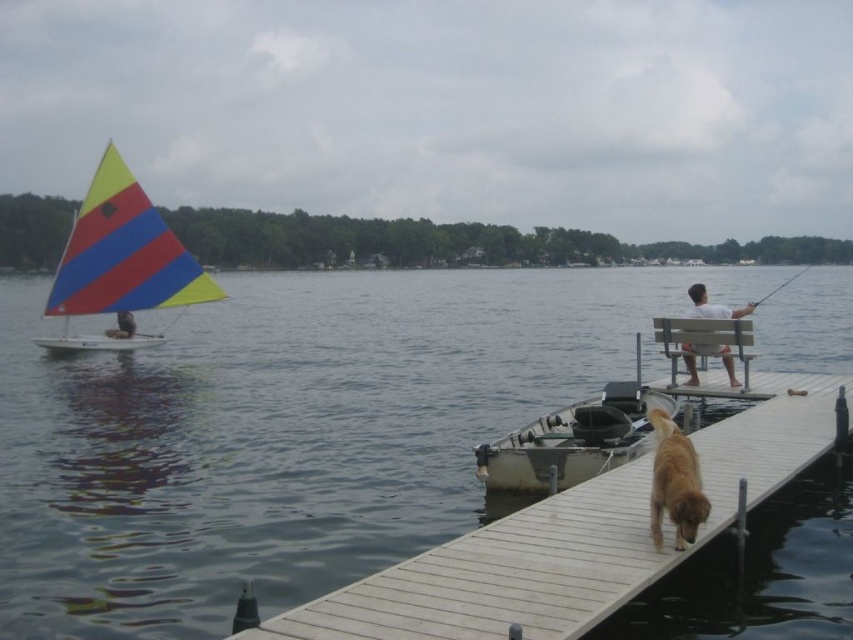
You are a photographer trying to capture the golden fur dog at lower right and the matte black sailboat at left in a single frame. Given that the dog is closer to you than the sailboat, will the dog appear larger in your photo?

The golden fur dog at lower right is bigger than the matte black sailboat at left, so even though the dog is closer, its actual size difference may make it appear larger in the photo depending on the camera angle and distance.

You are standing at the point labeled point (x=126, y=275) and want to walk to the point labeled point (x=776, y=291). Which direction should you face to walk towards your destination?

You should face upwards and to the right to walk towards point (x=776, y=291) from point (x=126, y=275).